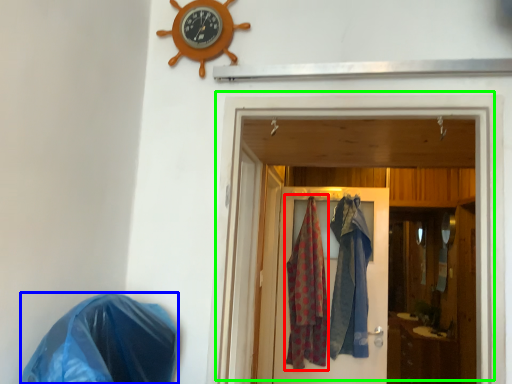
Question: Considering the real-world distances, which object is farthest from clothing (highlighted by a red box)? material (highlighted by a blue box) or door (highlighted by a green box)?

Choices:
 (A) material
 (B) door

Answer: (A)